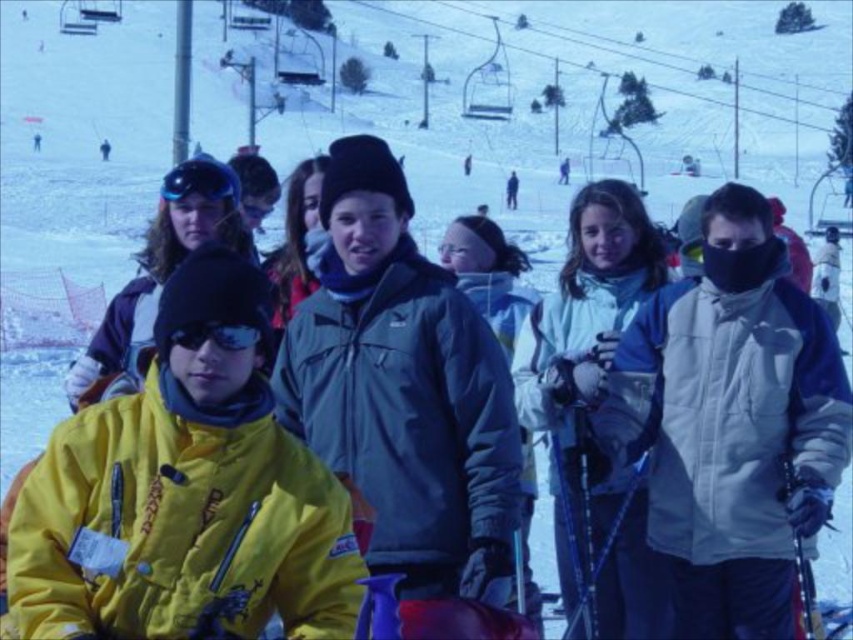
Who is more forward, (175, 172) or (223, 337)?

Positioned in front is point (223, 337).

I want to click on blue matte helmet at upper left, so click(x=200, y=180).